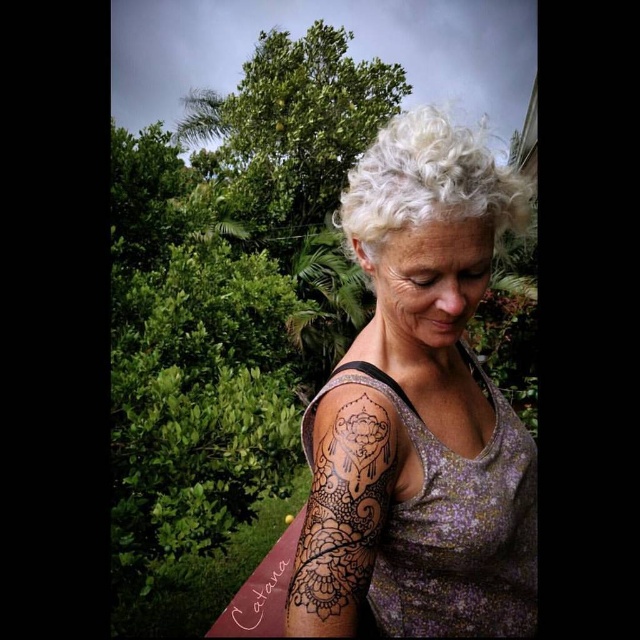
Can you confirm if black henna tattoo at upper right is positioned above white curly hair at upper center?

No.

Where is `black henna tattoo at upper right`? This screenshot has height=640, width=640. black henna tattoo at upper right is located at coordinates (419, 412).

I want to click on black henna tattoo at upper right, so click(419, 412).

Who is positioned more to the left, black henna tattoo at upper right or brown henna tattoo at upper right?

From the viewer's perspective, brown henna tattoo at upper right appears more on the left side.

Is black henna tattoo at upper right further to camera compared to brown henna tattoo at upper right?

That is False.

Measure the distance between point (404, 614) and camera.

A distance of 34.24 inches exists between point (404, 614) and camera.

Image resolution: width=640 pixels, height=640 pixels. Identify the location of black henna tattoo at upper right. (419, 412).

Is brown henna tattoo at upper right above white curly hair at upper center?

No.

Does brown henna tattoo at upper right appear on the left side of white curly hair at upper center?

Correct, you'll find brown henna tattoo at upper right to the left of white curly hair at upper center.

At what (x,y) coordinates should I click in order to perform the action: click on brown henna tattoo at upper right. Please return your answer as a coordinate pair (x, y). Image resolution: width=640 pixels, height=640 pixels. Looking at the image, I should click on (342, 509).

This screenshot has width=640, height=640. I want to click on brown henna tattoo at upper right, so click(x=342, y=509).